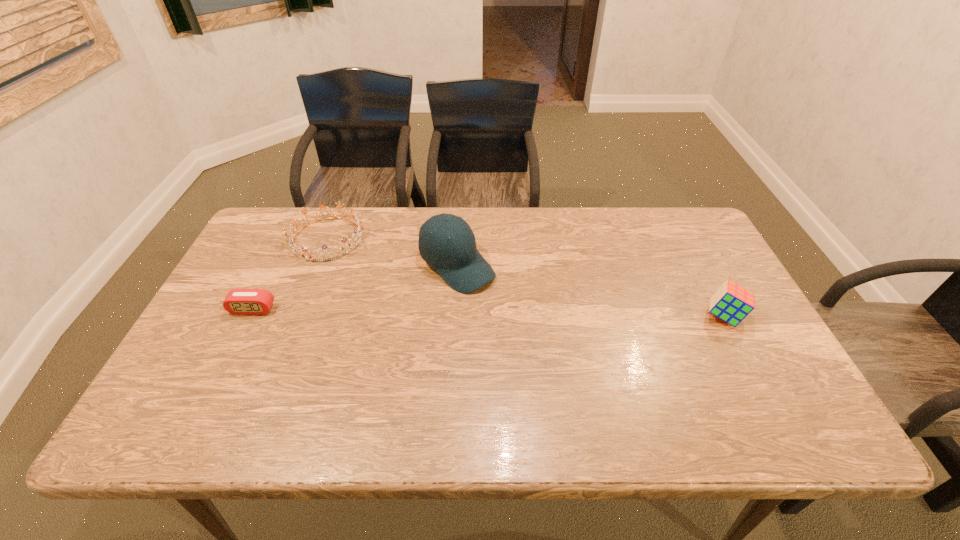
The image size is (960, 540). In order to click on free space at the far edge of the desktop in this screenshot , I will do `click(594, 233)`.

Where is `free spot at the near edge of the desktop`? This screenshot has height=540, width=960. free spot at the near edge of the desktop is located at coordinates (538, 384).

The height and width of the screenshot is (540, 960). I want to click on vacant space at the left edge of the desktop, so click(x=195, y=363).

Identify the location of free space at the right edge of the desktop. The width and height of the screenshot is (960, 540). (700, 287).

The image size is (960, 540). I want to click on free space at the far left corner, so click(x=267, y=212).

Where is `free region at the far right corner of the desktop`? The height and width of the screenshot is (540, 960). free region at the far right corner of the desktop is located at coordinates (659, 227).

This screenshot has height=540, width=960. I want to click on free space at the near right corner, so click(x=740, y=369).

You are a GUI agent. You are given a task and a screenshot of the screen. Output one action in this format:
    pyautogui.click(x=<x>, y=<y>)
    Task: Click on the unoccupied area between the third tallest object and the tallest object
    The height and width of the screenshot is (540, 960).
    Given the screenshot: What is the action you would take?
    pyautogui.click(x=393, y=252)

The image size is (960, 540). I want to click on vacant area between the shortest object and the third object from left to right, so click(x=355, y=287).

In order to click on empty space between the alarm clock and the third tallest object in this screenshot , I will do `click(290, 274)`.